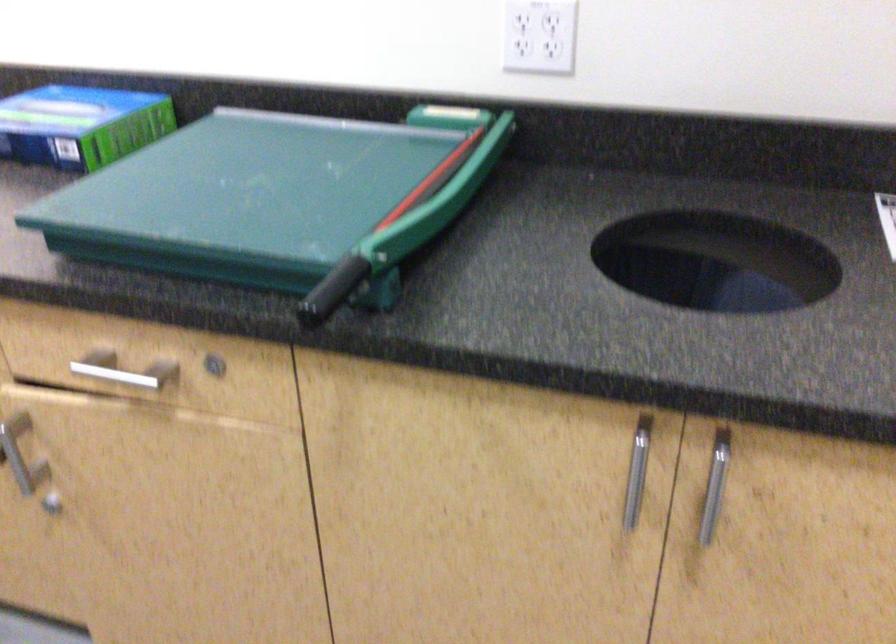
Describe the element at coordinates (123, 370) in the screenshot. I see `the wide silver handle` at that location.